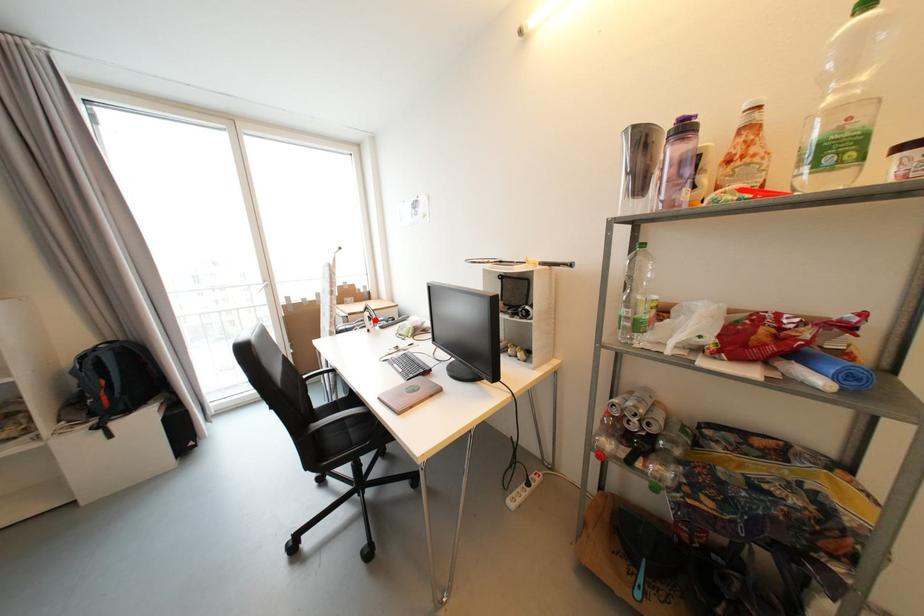
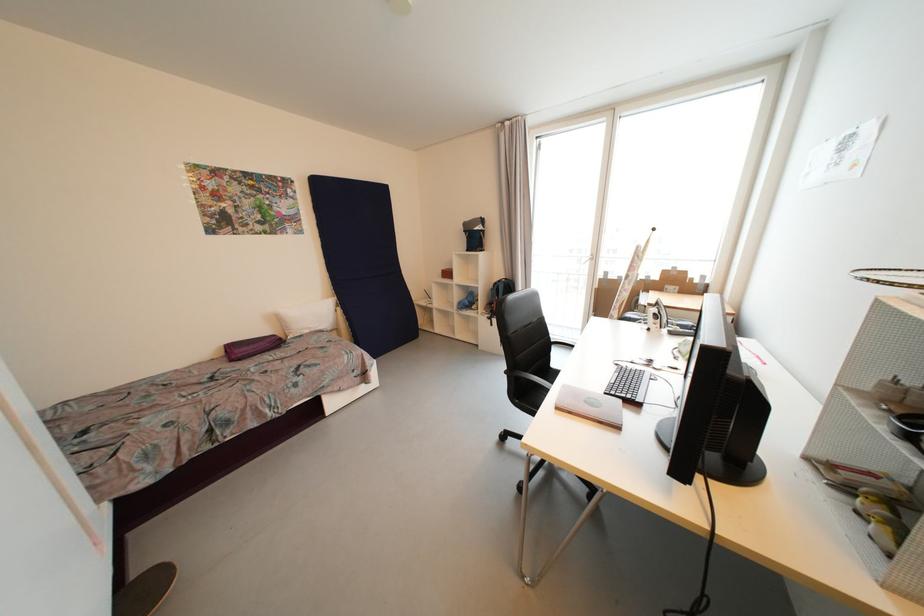
Locate, in the second image, the point that corresponds to the highlighted location in the first image.

(662, 318)